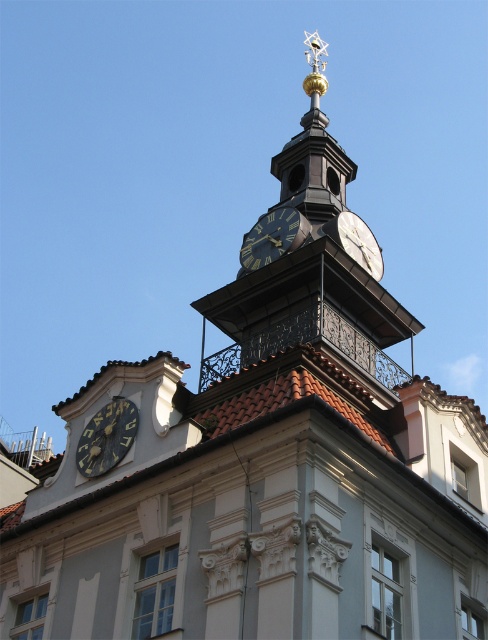
Between point (122, 436) and point (282, 237), which one is positioned in front?

Point (122, 436) is in front.

From the picture: Is dark brown wooden clock at lower left above dark brown wooden clock at center?

No.

Where is `dark brown wooden clock at lower left`? The image size is (488, 640). dark brown wooden clock at lower left is located at coordinates (106, 436).

Is point (296, 241) in front of point (380, 252)?

Yes, point (296, 241) is in front of point (380, 252).

Who is higher up, dark brown wooden clock at center or gold metallic clock at upper center?

dark brown wooden clock at center is above.

At what (x,y) coordinates should I click in order to perform the action: click on dark brown wooden clock at center. Please return your answer as a coordinate pair (x, y). Image resolution: width=488 pixels, height=640 pixels. Looking at the image, I should click on (272, 237).

In order to click on dark brown wooden clock at center in this screenshot , I will do `click(272, 237)`.

From the picture: Between dark brown wooden clock at lower left and gold metallic clock at upper center, which one has more height?

gold metallic clock at upper center

You are a GUI agent. You are given a task and a screenshot of the screen. Output one action in this format:
    pyautogui.click(x=<x>, y=<y>)
    Task: Click on the dark brown wooden clock at lower left
    
    Given the screenshot: What is the action you would take?
    pyautogui.click(x=106, y=436)